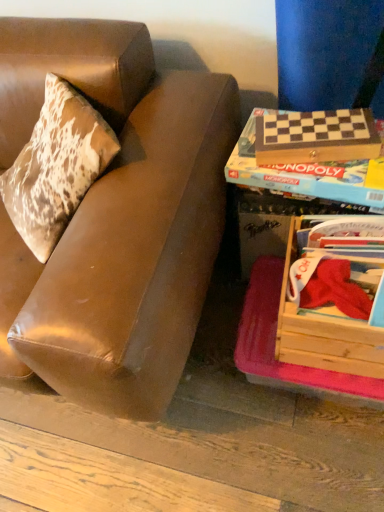
Question: Relative to wooden monopoly box at right, is wooden crate at lower right in front or behind?

Choices:
 (A) front
 (B) behind

Answer: (A)

Question: From a real-world perspective, is wooden crate at lower right positioned above or below wooden monopoly box at right?

Choices:
 (A) above
 (B) below

Answer: (B)

Question: Which object is positioned closest to the wooden checkered board at right, the first paperback book positioned from the top?

Choices:
 (A) wooden crate at lower right
 (B) wooden checkered board at right, placed as the 1th paperback book when sorted from bottom to top
 (C) brown leather couch at left
 (D) wooden monopoly box at right

Answer: (B)

Question: Which object is the farthest from the wooden checkered board at right, which is the 2th paperback book from bottom to top?

Choices:
 (A) brown leather couch at left
 (B) wooden checkered board at right, the second paperback book in the top-to-bottom sequence
 (C) wooden monopoly box at right
 (D) wooden crate at lower right

Answer: (A)